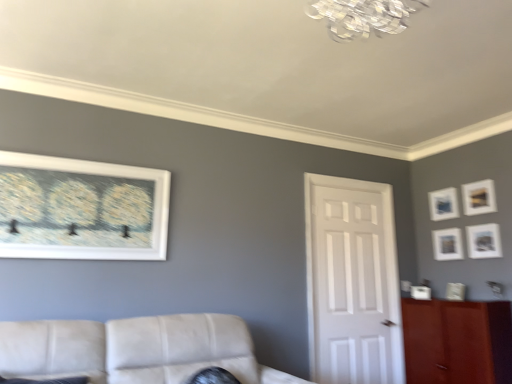
Question: Should I look upward or downward to see matte blue picture frame at upper right, the third picture frame viewed from the right?

Choices:
 (A) up
 (B) down

Answer: (B)

Question: Considering the relative sizes of matte white picture frame at upper right, marked as the 2th picture frame in a back-to-front arrangement, and matte blue picture frame at upper right, acting as the 4th picture frame starting from the left, in the image provided, is matte white picture frame at upper right, marked as the 2th picture frame in a back-to-front arrangement, wider than matte blue picture frame at upper right, acting as the 4th picture frame starting from the left,?

Choices:
 (A) no
 (B) yes

Answer: (B)

Question: Is matte white picture frame at upper right, which is the 4th picture frame in right-to-left order, positioned in front of matte blue picture frame at upper right, acting as the 4th picture frame starting from the left?

Choices:
 (A) yes
 (B) no

Answer: (A)

Question: Considering the relative sizes of matte white picture frame at upper right, which is the 4th picture frame in right-to-left order, and matte blue picture frame at upper right, the sixth picture frame viewed from the front, in the image provided, is matte white picture frame at upper right, which is the 4th picture frame in right-to-left order, bigger than matte blue picture frame at upper right, the sixth picture frame viewed from the front,?

Choices:
 (A) yes
 (B) no

Answer: (A)

Question: From a real-world perspective, is matte white picture frame at upper right, marked as the 2th picture frame in a back-to-front arrangement, on top of matte blue picture frame at upper right, the 1th picture frame viewed from the back?

Choices:
 (A) yes
 (B) no

Answer: (B)

Question: Is matte white picture frame at upper right, positioned as the 5th picture frame in front-to-back order, facing away from matte blue picture frame at upper right, the third picture frame viewed from the right?

Choices:
 (A) yes
 (B) no

Answer: (B)

Question: Is the depth of matte white picture frame at upper right, marked as the 2th picture frame in a back-to-front arrangement, greater than that of matte blue picture frame at upper right, the 1th picture frame viewed from the back?

Choices:
 (A) no
 (B) yes

Answer: (A)

Question: Is matte gold picture frame at upper right, which is the 5th picture frame in left-to-right order, looking in the opposite direction of matte white picture frame at right, which ranks as the 5th picture frame in back-to-front order?

Choices:
 (A) yes
 (B) no

Answer: (B)

Question: Considering the relative sizes of matte gold picture frame at upper right, positioned as the 2th picture frame in right-to-left order, and matte white picture frame at right, positioned as the sixth picture frame in left-to-right order, in the image provided, is matte gold picture frame at upper right, positioned as the 2th picture frame in right-to-left order, wider than matte white picture frame at right, positioned as the sixth picture frame in left-to-right order,?

Choices:
 (A) yes
 (B) no

Answer: (A)

Question: Is matte gold picture frame at upper right, positioned as the 2th picture frame in right-to-left order, positioned far away from matte white picture frame at right, the second picture frame viewed from the front?

Choices:
 (A) no
 (B) yes

Answer: (A)

Question: Can you see matte gold picture frame at upper right, which is the 5th picture frame in left-to-right order, touching matte white picture frame at right, the second picture frame viewed from the front?

Choices:
 (A) no
 (B) yes

Answer: (A)

Question: Considering the relative positions of matte gold picture frame at upper right, placed as the 4th picture frame when sorted from back to front, and matte white picture frame at right, the second picture frame viewed from the front, in the image provided, is matte gold picture frame at upper right, placed as the 4th picture frame when sorted from back to front, behind matte white picture frame at right, the second picture frame viewed from the front,?

Choices:
 (A) yes
 (B) no

Answer: (A)

Question: From the image's perspective, is matte gold picture frame at upper right, which ranks as the third picture frame in front-to-back order, below matte white picture frame at right, the second picture frame viewed from the front?

Choices:
 (A) no
 (B) yes

Answer: (A)

Question: Is white glossy door at center located within brown wood cabinet at right?

Choices:
 (A) no
 (B) yes

Answer: (A)